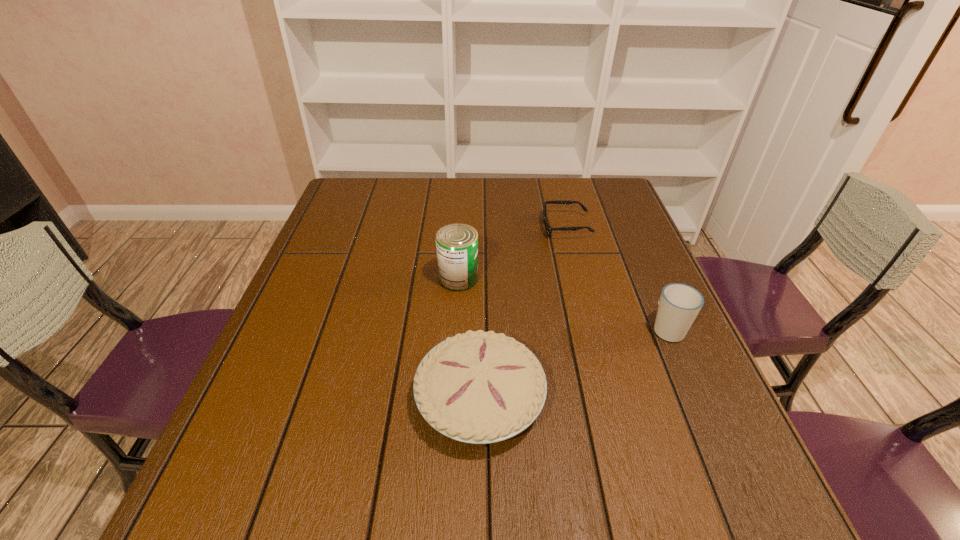
This screenshot has width=960, height=540. I want to click on vacant space that satisfies the following two spatial constraints: 1. with a handle on the side of the second nearest object; 2. on the front-facing side of the sunglasses, so click(x=624, y=227).

I want to click on free space that satisfies the following two spatial constraints: 1. on the front-facing side of the second object from right to left; 2. on the front side of the nearest object, so [610, 398].

You are a GUI agent. You are given a task and a screenshot of the screen. Output one action in this format:
    pyautogui.click(x=<x>, y=<y>)
    Task: Click on the free space that satisfies the following two spatial constraints: 1. on the front side of the can; 2. on the left side of the nearest object
    The image size is (960, 540).
    Given the screenshot: What is the action you would take?
    pyautogui.click(x=452, y=398)